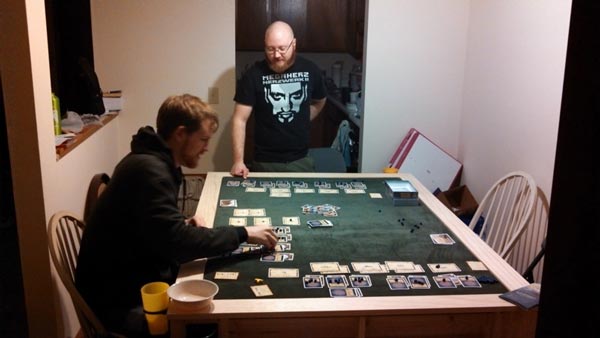
Find the location of a particular element. bowl is located at coordinates (195, 295).